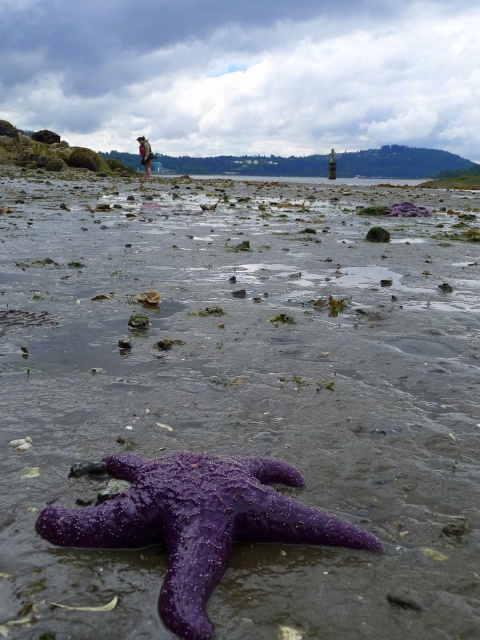
You are a photographer trying to capture both the purple rough starfish at lower center and the dark brown leather jacket at upper left in a single frame. Which object should you focus on first to ensure both are in the same shot?

The purple rough starfish at lower center should be focused on first since it is smaller in size compared to the dark brown leather jacket at upper left, ensuring it is properly captured within the frame.

Looking at this image, you are a photographer trying to capture the purple wet mud at center and the dark brown leather jacket at upper left in the same frame. Based on their positions, which object would you need to focus on first when adjusting your camera lens?

The dark brown leather jacket at upper left is located above the purple wet mud at center, so you should focus on the dark brown leather jacket at upper left first as it is closer to the camera.